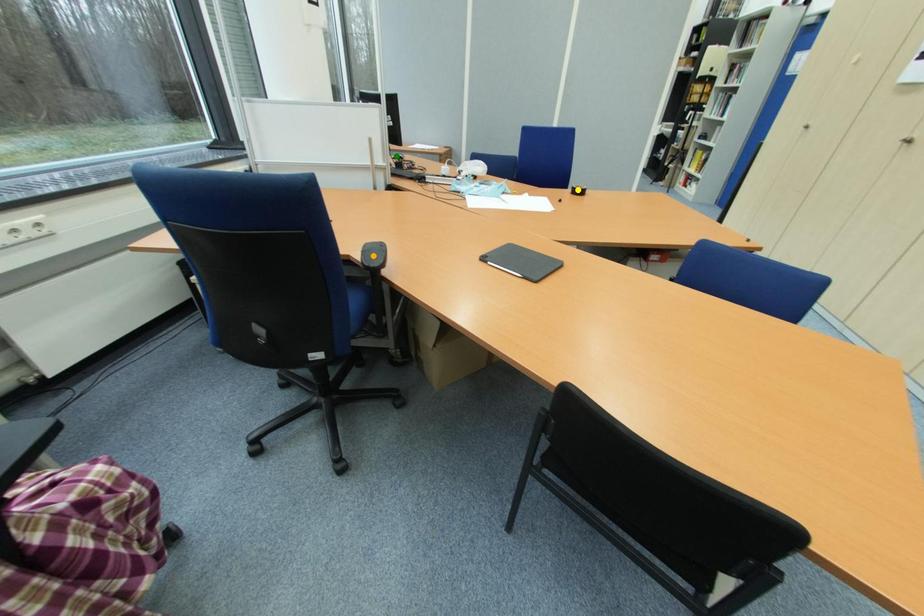
Order these from farthest to nearest:
A) orange point
B) green point
C) yellow point

green point, yellow point, orange point